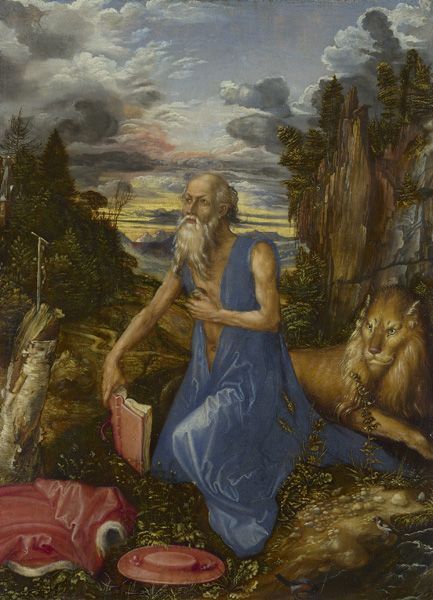
The width and height of the screenshot is (433, 600). Identify the location of book. (132, 432).